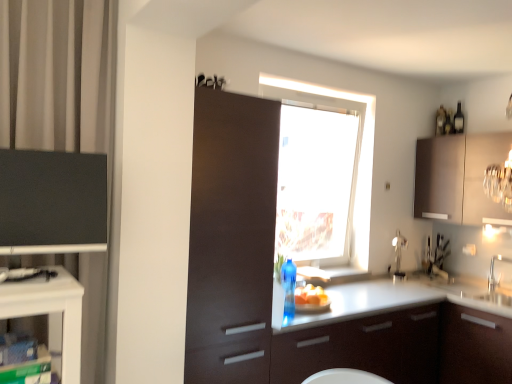
Find the location of `satin brown cabinet at upper right, the 1th cabinetry positioned from the back`. satin brown cabinet at upper right, the 1th cabinetry positioned from the back is located at coordinates (458, 177).

Describe the element at coordinates (458, 120) in the screenshot. I see `black glass bottle at upper right` at that location.

What do you see at coordinates (498, 284) in the screenshot? I see `white glossy sink at right` at bounding box center [498, 284].

The height and width of the screenshot is (384, 512). What do you see at coordinates (310, 295) in the screenshot? I see `yellow matte bread at lower center` at bounding box center [310, 295].

Locate an element on the screen. white glossy countertop at center is located at coordinates (397, 337).

Considering the positions of objects satin brown cabinet at upper right, the 1th cabinetry positioned from the back, and matte black cabinet at left, placed as the third cabinetry when sorted from right to left, in the image provided, who is more to the left, satin brown cabinet at upper right, the 1th cabinetry positioned from the back, or matte black cabinet at left, placed as the third cabinetry when sorted from right to left,?

matte black cabinet at left, placed as the third cabinetry when sorted from right to left.

At what (x,y) coordinates should I click in order to perform the action: click on cabinetry that is the 1st one when counting downward from the satin brown cabinet at upper right, acting as the third cabinetry starting from the front (from the image's perspective). Please return your answer as a coordinate pair (x, y). This screenshot has width=512, height=384. Looking at the image, I should click on (52, 202).

Is satin brown cabinet at upper right, acting as the third cabinetry starting from the front, looking in the opposite direction of matte black cabinet at left, acting as the 1th cabinetry starting from the left?

No, satin brown cabinet at upper right, acting as the third cabinetry starting from the front,'s orientation is not away from matte black cabinet at left, acting as the 1th cabinetry starting from the left.

Does satin brown cabinet at upper right, acting as the third cabinetry starting from the front, have a larger size compared to matte black cabinet at left, placed as the 1th cabinetry when sorted from front to back?

Yes.

Is matte brown cabinet at center, the second cabinetry in the left-to-right sequence, positioned beyond the bounds of satin brown cabinet at upper right, acting as the third cabinetry starting from the front?

Yes, matte brown cabinet at center, the second cabinetry in the left-to-right sequence, is outside of satin brown cabinet at upper right, acting as the third cabinetry starting from the front.

From the image's perspective, does matte brown cabinet at center, which appears as the 2th cabinetry when viewed from the front, appear lower than satin brown cabinet at upper right, the third cabinetry in the left-to-right sequence?

Correct, matte brown cabinet at center, which appears as the 2th cabinetry when viewed from the front, appears lower than satin brown cabinet at upper right, the third cabinetry in the left-to-right sequence, in the image.

Can you confirm if matte brown cabinet at center, positioned as the 2th cabinetry in right-to-left order, is shorter than satin brown cabinet at upper right, the 1th cabinetry positioned from the back?

No.

Can you confirm if matte brown cabinet at center, which appears as the 2th cabinetry when viewed from the front, is positioned to the right of satin brown cabinet at upper right, acting as the third cabinetry starting from the front?

In fact, matte brown cabinet at center, which appears as the 2th cabinetry when viewed from the front, is to the left of satin brown cabinet at upper right, acting as the third cabinetry starting from the front.

Which is behind, point (355, 303) or point (419, 190)?

Positioned behind is point (419, 190).

Is white glossy countertop at center inside or outside of satin brown cabinet at upper right, acting as the third cabinetry starting from the front?

white glossy countertop at center exists outside the volume of satin brown cabinet at upper right, acting as the third cabinetry starting from the front.

Could you measure the distance between white glossy countertop at center and satin brown cabinet at upper right, the first cabinetry in the right-to-left sequence?

A distance of 3.54 feet exists between white glossy countertop at center and satin brown cabinet at upper right, the first cabinetry in the right-to-left sequence.

From a real-world perspective, who is located higher, white glossy countertop at center or satin brown cabinet at upper right, the third cabinetry in the left-to-right sequence?

From a 3D spatial view, satin brown cabinet at upper right, the third cabinetry in the left-to-right sequence, is above.

Could you measure the distance between black glass bottle at upper right and satin brown cabinet at upper right, the 1th cabinetry positioned from the back?

A distance of 22.07 inches exists between black glass bottle at upper right and satin brown cabinet at upper right, the 1th cabinetry positioned from the back.

Would you say satin brown cabinet at upper right, the first cabinetry in the right-to-left sequence, is part of black glass bottle at upper right's contents?

No.

Between black glass bottle at upper right and satin brown cabinet at upper right, the first cabinetry in the right-to-left sequence, which one has less height?

Standing shorter between the two is black glass bottle at upper right.

Considering the positions of objects black glass bottle at upper right and satin brown cabinet at upper right, the 1th cabinetry positioned from the back, in the image provided, who is more to the right, black glass bottle at upper right or satin brown cabinet at upper right, the 1th cabinetry positioned from the back,?

black glass bottle at upper right is more to the right.

Between matte brown cabinet at center, which appears as the 2th cabinetry when viewed from the front, and black glass bottle at upper right, which one has larger size?

matte brown cabinet at center, which appears as the 2th cabinetry when viewed from the front.

Is matte brown cabinet at center, positioned as the 2th cabinetry in right-to-left order, facing towards black glass bottle at upper right?

No, matte brown cabinet at center, positioned as the 2th cabinetry in right-to-left order, is not facing towards black glass bottle at upper right.

Where is `the 3rd cabinetry positioned below the black glass bottle at upper right (from a real-world perspective)`? The width and height of the screenshot is (512, 384). the 3rd cabinetry positioned below the black glass bottle at upper right (from a real-world perspective) is located at coordinates click(231, 238).

Could you measure the distance between matte brown cabinet at center, which appears as the 2th cabinetry when viewed from the front, and black glass bottle at upper right?

matte brown cabinet at center, which appears as the 2th cabinetry when viewed from the front, and black glass bottle at upper right are 8.51 feet apart.

Considering the sizes of objects black glass bottle at upper right and yellow matte bread at lower center in the image provided, who is bigger, black glass bottle at upper right or yellow matte bread at lower center?

Bigger between the two is black glass bottle at upper right.

From the picture: Is black glass bottle at upper right next to yellow matte bread at lower center?

No, black glass bottle at upper right is not next to yellow matte bread at lower center.

Is black glass bottle at upper right to the right of yellow matte bread at lower center from the viewer's perspective?

Yes, black glass bottle at upper right is to the right of yellow matte bread at lower center.

Can we say black glass bottle at upper right lies outside yellow matte bread at lower center?

black glass bottle at upper right is positioned outside yellow matte bread at lower center.

From a real-world perspective, is transparent glass window at center below black glass bottle at upper right?

Yes, from a real-world perspective, transparent glass window at center is beneath black glass bottle at upper right.

Considering the positions of objects transparent glass window at center and black glass bottle at upper right in the image provided, who is more to the left, transparent glass window at center or black glass bottle at upper right?

transparent glass window at center.

Is transparent glass window at center not near black glass bottle at upper right?

transparent glass window at center is positioned a significant distance from black glass bottle at upper right.

Between transparent glass window at center and black glass bottle at upper right, which one has larger width?

With larger width is transparent glass window at center.

Identify the location of the 2nd cabinetry to the right when counting from the matte black cabinet at left, acting as the 1th cabinetry starting from the left. The height and width of the screenshot is (384, 512). (458, 177).

From the satin brown cabinet at upper right, the 1th cabinetry positioned from the back, count the 1st cabinetry to the left and point to it. Please provide its 2D coordinates.

[(231, 238)]

Which object lies nearer to the anchor point yellow matte bread at lower center, transparent glass window at center or satin brown cabinet at upper right, acting as the third cabinetry starting from the front?

transparent glass window at center lies closer to yellow matte bread at lower center than the other object.

Based on their spatial positions, is transparent glass window at center or satin brown cabinet at upper right, the first cabinetry in the right-to-left sequence, further from white glossy countertop at center?

Among the two, satin brown cabinet at upper right, the first cabinetry in the right-to-left sequence, is located further to white glossy countertop at center.

Estimate the real-world distances between objects in this image. Which object is closer to yellow matte bread at lower center, satin brown cabinet at upper right, the first cabinetry in the right-to-left sequence, or matte brown cabinet at center, which appears as the 2th cabinetry when viewed from the front?

matte brown cabinet at center, which appears as the 2th cabinetry when viewed from the front, lies closer to yellow matte bread at lower center than the other object.

Looking at the image, which one is located closer to black glass bottle at upper right, matte black cabinet at left, placed as the 1th cabinetry when sorted from front to back, or satin brown cabinet at upper right, the third cabinetry in the left-to-right sequence?

satin brown cabinet at upper right, the third cabinetry in the left-to-right sequence, is closer to black glass bottle at upper right.

Considering their positions, is white glossy countertop at center positioned closer to yellow matte bread at lower center than satin brown cabinet at upper right, the first cabinetry in the right-to-left sequence?

white glossy countertop at center lies closer to yellow matte bread at lower center than the other object.

When comparing their distances from white glossy countertop at center, does satin brown cabinet at upper right, the first cabinetry in the right-to-left sequence, or black glass bottle at upper right seem further?

black glass bottle at upper right lies further to white glossy countertop at center than the other object.

Estimate the real-world distances between objects in this image. Which object is further from transparent glass window at center, matte brown cabinet at center, which appears as the 2th cabinetry when viewed from the front, or black glass bottle at upper right?

matte brown cabinet at center, which appears as the 2th cabinetry when viewed from the front.

In the scene shown: Considering their positions, is matte black cabinet at left, placed as the 1th cabinetry when sorted from front to back, positioned further to satin brown cabinet at upper right, the third cabinetry in the left-to-right sequence, than matte brown cabinet at center, which appears as the 2th cabinetry when viewed from the front?

matte black cabinet at left, placed as the 1th cabinetry when sorted from front to back, is positioned further to the anchor satin brown cabinet at upper right, the third cabinetry in the left-to-right sequence.

Locate an element on the screen. This screenshot has height=384, width=512. countertop located between matte black cabinet at left, acting as the 1th cabinetry starting from the left, and yellow matte bread at lower center in the depth direction is located at coordinates (397, 337).

Where is `window between matte black cabinet at left, acting as the 3th cabinetry starting from the back, and black glass bottle at upper right from front to back`? Image resolution: width=512 pixels, height=384 pixels. window between matte black cabinet at left, acting as the 3th cabinetry starting from the back, and black glass bottle at upper right from front to back is located at coordinates pos(358,161).

Image resolution: width=512 pixels, height=384 pixels. In order to click on cabinetry between matte black cabinet at left, placed as the third cabinetry when sorted from right to left, and transparent glass window at center from front to back in this screenshot , I will do `click(231, 238)`.

In order to click on countertop situated between transparent glass window at center and satin brown cabinet at upper right, the 1th cabinetry positioned from the back, from left to right in this screenshot , I will do click(x=397, y=337).